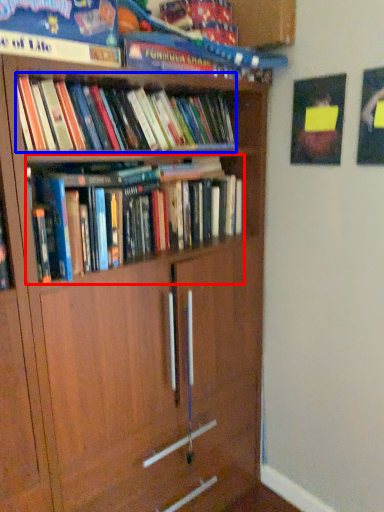
Question: Which point is closer to the camera, book (highlighted by a red box) or book (highlighted by a blue box)?

Choices:
 (A) book
 (B) book

Answer: (B)